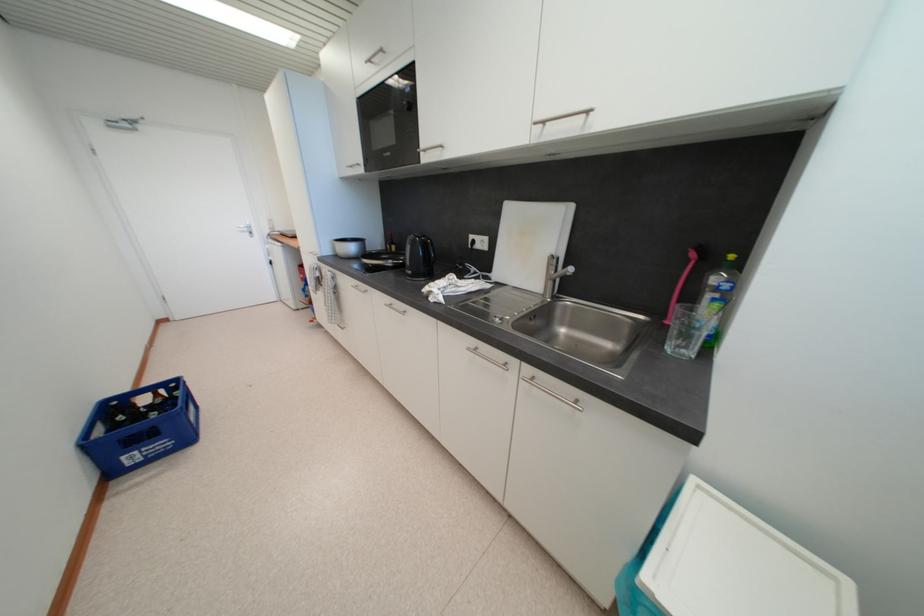
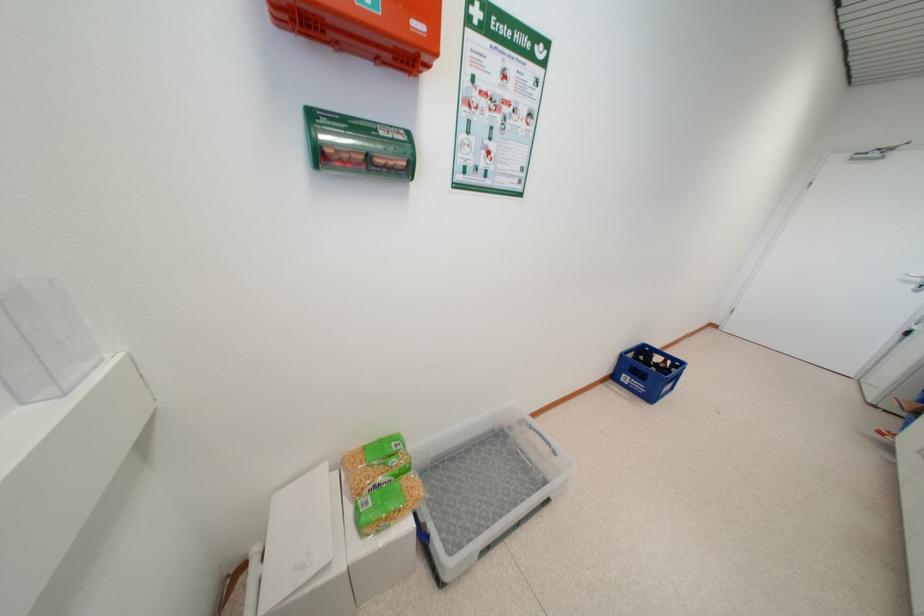
Where in the second image is the point corresponding to point 161,398 from the first image?

(669, 363)